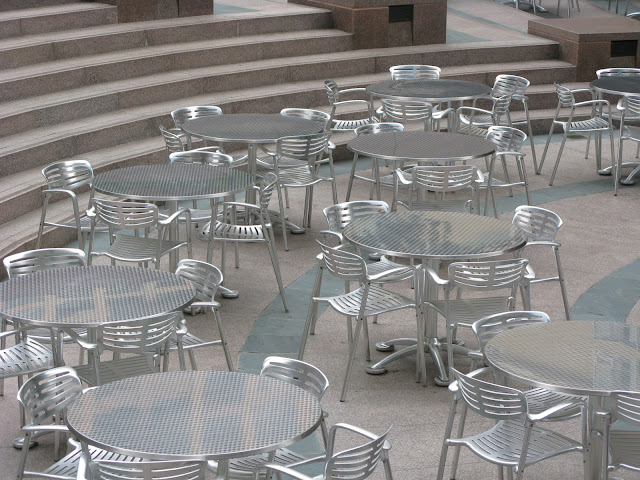
I want to click on table 3 chairs, so click(x=344, y=255), click(x=342, y=205), click(x=532, y=208), click(x=493, y=272).